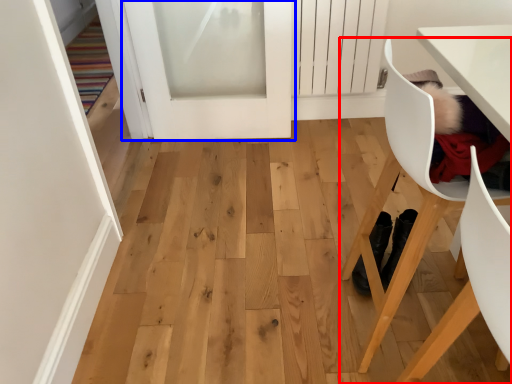
Question: Which point is closer to the camera, chair (highlighted by a red box) or door (highlighted by a blue box)?

Choices:
 (A) chair
 (B) door

Answer: (A)